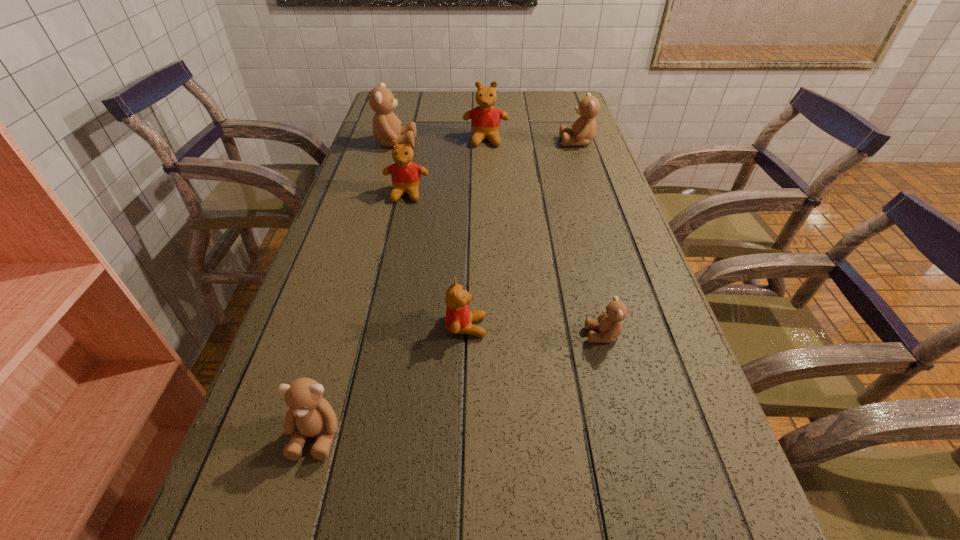
You are a GUI agent. You are given a task and a screenshot of the screen. Output one action in this format:
    pyautogui.click(x=<x>, y=<y>)
    Task: Click on the vacant area situated on the front-facing side of the biggest brown teddy bear
    The width and height of the screenshot is (960, 540).
    Given the screenshot: What is the action you would take?
    pyautogui.click(x=536, y=143)

Identify the location of vacant space located on the front-facing side of the biggest red teddy bear. (487, 205).

The image size is (960, 540). I want to click on vacant space located on the front-facing side of the third smallest brown teddy bear, so click(x=505, y=143).

Identify the location of vacant space situated 0.370m on the front-facing side of the third smallest brown teddy bear. (446, 143).

This screenshot has width=960, height=540. Find the location of `free space located on the front-facing side of the third smallest brown teddy bear`. free space located on the front-facing side of the third smallest brown teddy bear is located at coordinates (449, 143).

You are a GUI agent. You are given a task and a screenshot of the screen. Output one action in this format:
    pyautogui.click(x=<x>, y=<y>)
    Task: Click on the vacant space located on the front-facing side of the leftmost red teddy bear
    
    Given the screenshot: What is the action you would take?
    pyautogui.click(x=395, y=250)

The width and height of the screenshot is (960, 540). What are the coordinates of `vacant space located 0.090m on the front-facing side of the smallest red teddy bear` in the screenshot? It's located at (531, 327).

Locate an element on the screen. vacant space situated 0.060m on the front-facing side of the second smallest brown teddy bear is located at coordinates (297, 503).

The width and height of the screenshot is (960, 540). I want to click on free space located on the front-facing side of the second nearest brown teddy bear, so click(550, 335).

Find the location of `vacant space located on the front-facing side of the second nearest brown teddy bear`. vacant space located on the front-facing side of the second nearest brown teddy bear is located at coordinates (555, 335).